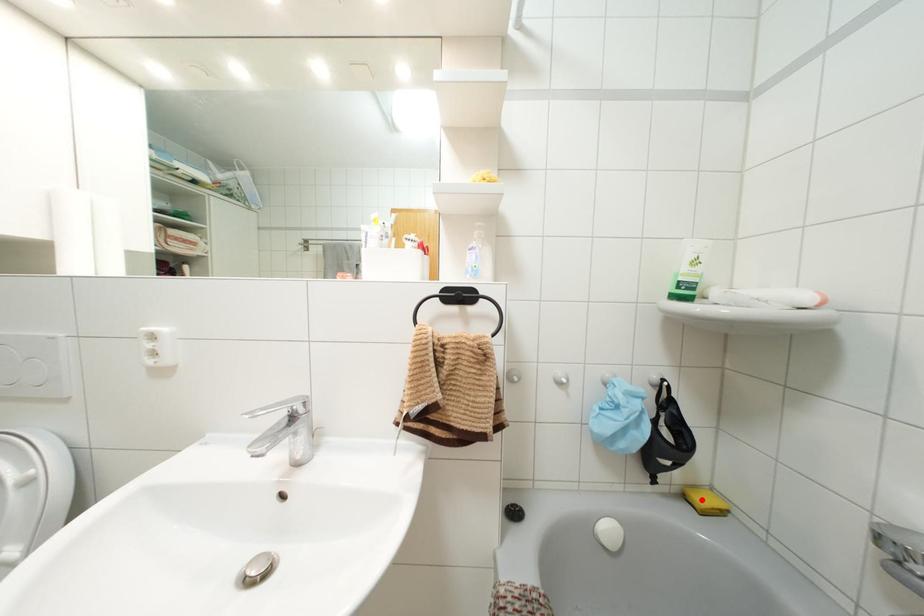
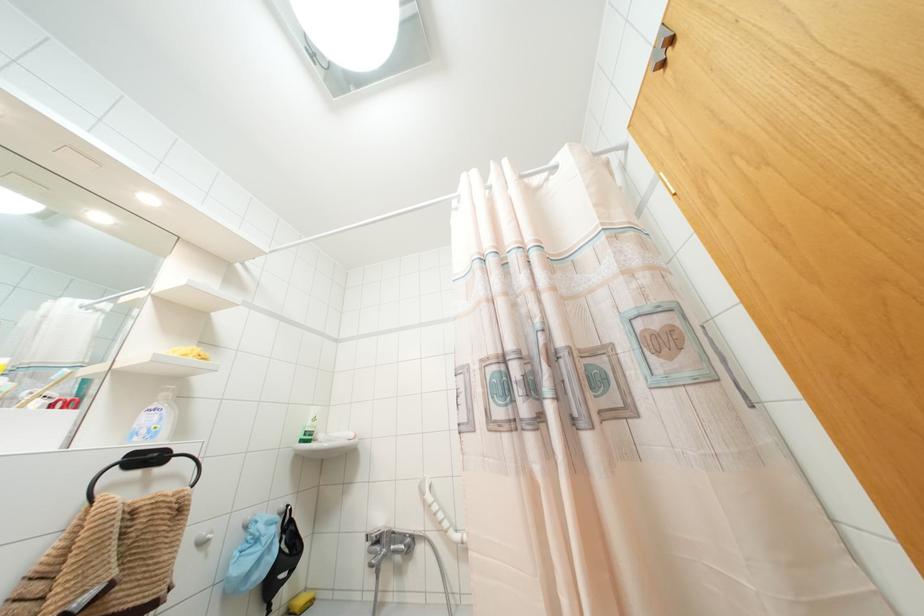
Where in the second image is the point corresponding to the highlighted location from the first image?

(299, 601)